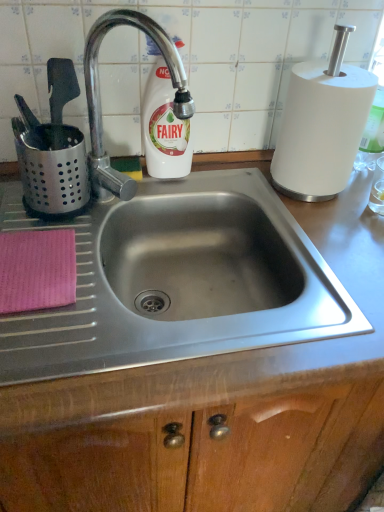
Question: From the image's perspective, is white matte paper towel at upper right above or below pink woven cloth at lower left?

Choices:
 (A) below
 (B) above

Answer: (B)

Question: Considering the positions of point (276, 161) and point (8, 297), is point (276, 161) closer or farther from the camera than point (8, 297)?

Choices:
 (A) farther
 (B) closer

Answer: (A)

Question: Estimate the real-world distances between objects in this image. Which object is farther from the white matte paper towel at upper right?

Choices:
 (A) polished metal faucet at upper left
 (B) pink woven cloth at lower left
 (C) metallic stainless steel sink at center
 (D) white glossy bottle at upper center

Answer: (B)

Question: Considering the real-world distances, which object is closest to the metallic stainless steel sink at center?

Choices:
 (A) polished metal faucet at upper left
 (B) white matte paper towel at upper right
 (C) pink woven cloth at lower left
 (D) white glossy bottle at upper center

Answer: (B)